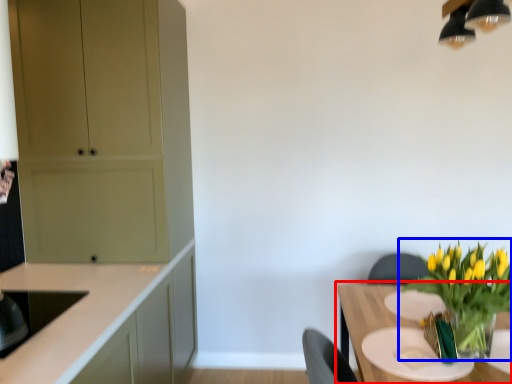
Question: Which of the following is the farthest to the observer, table (highlighted by a red box) or houseplant (highlighted by a blue box)?

Choices:
 (A) table
 (B) houseplant

Answer: (B)